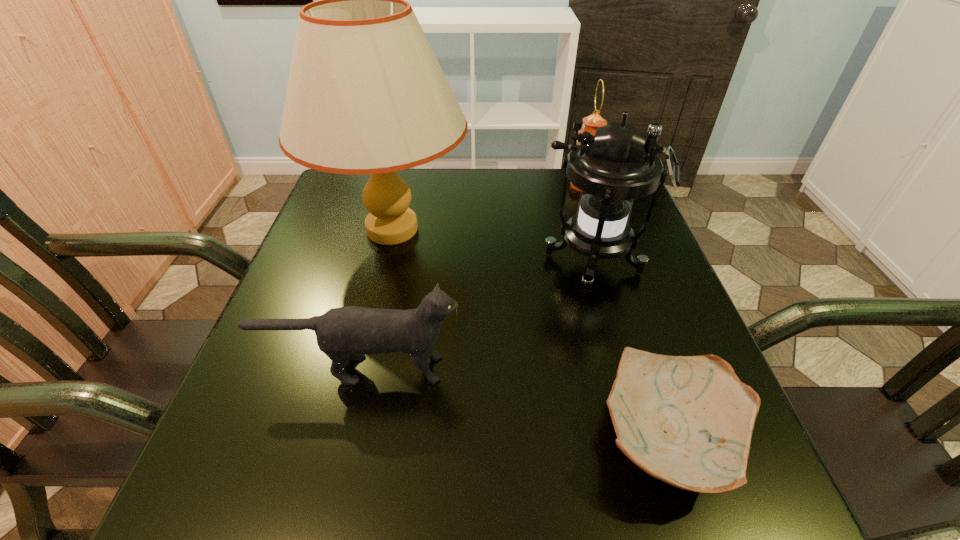
Where is `free area in between the cat and the third tallest object`? The width and height of the screenshot is (960, 540). free area in between the cat and the third tallest object is located at coordinates 473,277.

Identify the location of vacant space that's between the lantern and the second shortest object. Image resolution: width=960 pixels, height=540 pixels. (478, 316).

Identify the location of free space that is in between the fourth tallest object and the lantern. (478, 316).

At what (x,y) coordinates should I click in order to perform the action: click on vacant area that lies between the second tallest object and the lampshade. Please return your answer as a coordinate pair (x, y). Looking at the image, I should click on (492, 247).

The image size is (960, 540). I want to click on the second closest object relative to the lantern, so click(x=591, y=123).

Find the location of `the third closest object relative to the pottery`. the third closest object relative to the pottery is located at coordinates (366, 95).

The width and height of the screenshot is (960, 540). In order to click on vacant space that satisfies the following two spatial constraints: 1. on the front-facing side of the pottery; 2. on the right side of the cat in this screenshot , I will do `click(346, 439)`.

The height and width of the screenshot is (540, 960). I want to click on blank space that satisfies the following two spatial constraints: 1. on the front side of the lantern; 2. on the right side of the pottery, so [x=643, y=439].